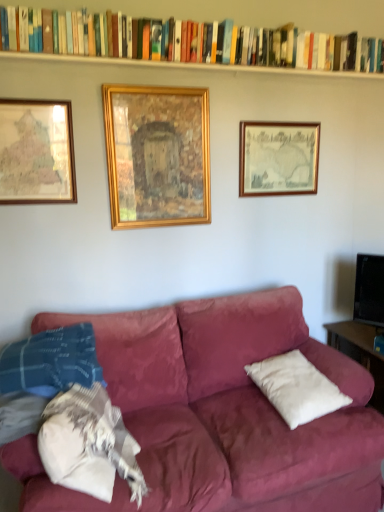
Question: Would you say wooden framed map at upper right, the third picture frame viewed from the left, is inside or outside gold wooden frame at center, the 2th picture frame from the left?

Choices:
 (A) inside
 (B) outside

Answer: (B)

Question: From their relative heights in the image, would you say wooden framed map at upper right, the third picture frame viewed from the left, is taller or shorter than gold wooden frame at center, the 2th picture frame from the right?

Choices:
 (A) short
 (B) tall

Answer: (A)

Question: Which object is the farthest from the wooden framed map at upper right, the third picture frame viewed from the left?

Choices:
 (A) gold wooden frame at center, the 2th picture frame from the left
 (B) wooden map at left, placed as the 1th picture frame when sorted from left to right
 (C) hardcover book at upper center
 (D) white soft cushion at right
 (E) white painted wood at upper center

Answer: (D)

Question: Which of these objects is positioned farthest from the hardcover book at upper center?

Choices:
 (A) wooden map at left, placed as the 1th picture frame when sorted from left to right
 (B) wooden framed map at upper right, the first picture frame in the right-to-left sequence
 (C) white painted wood at upper center
 (D) gold wooden frame at center, the 2th picture frame from the left
 (E) white soft cushion at right

Answer: (E)